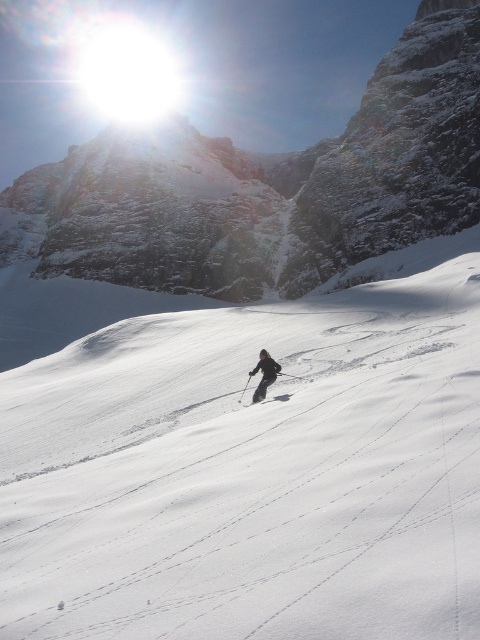
Question: Can you confirm if white powder snow at center is bigger than snowy rocky mountain at upper center?

Choices:
 (A) no
 (B) yes

Answer: (A)

Question: Can you confirm if snowy rocky mountain at upper center is positioned to the left of white matte ski at center?

Choices:
 (A) yes
 (B) no

Answer: (A)

Question: Among these points, which one is farthest from the camera?

Choices:
 (A) (143, 545)
 (B) (229, 237)

Answer: (B)

Question: Is snowy rocky mountain at upper center positioned behind black matte snowboarder at center?

Choices:
 (A) yes
 (B) no

Answer: (A)

Question: Which point is farther to the camera?

Choices:
 (A) (263, 356)
 (B) (441, 156)

Answer: (B)

Question: Which point is closer to the camera?

Choices:
 (A) snowy rocky mountain at upper center
 (B) white powder snow at center
 (C) white matte ski at center

Answer: (B)